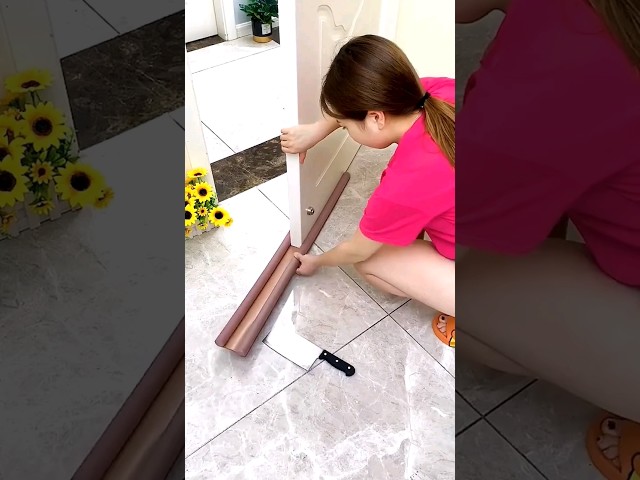
Locate an element on the screen. This screenshot has height=480, width=640. white floor is located at coordinates (226, 91).